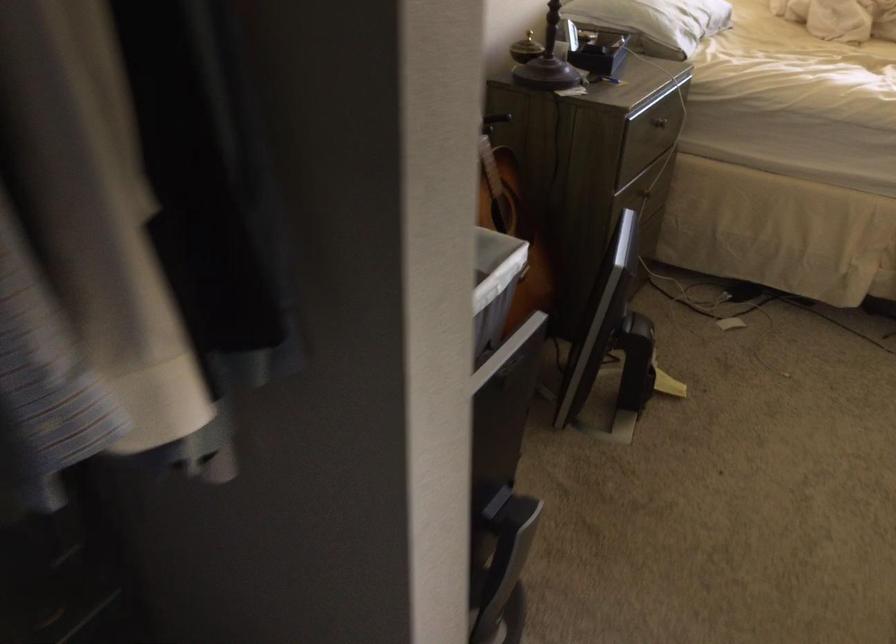
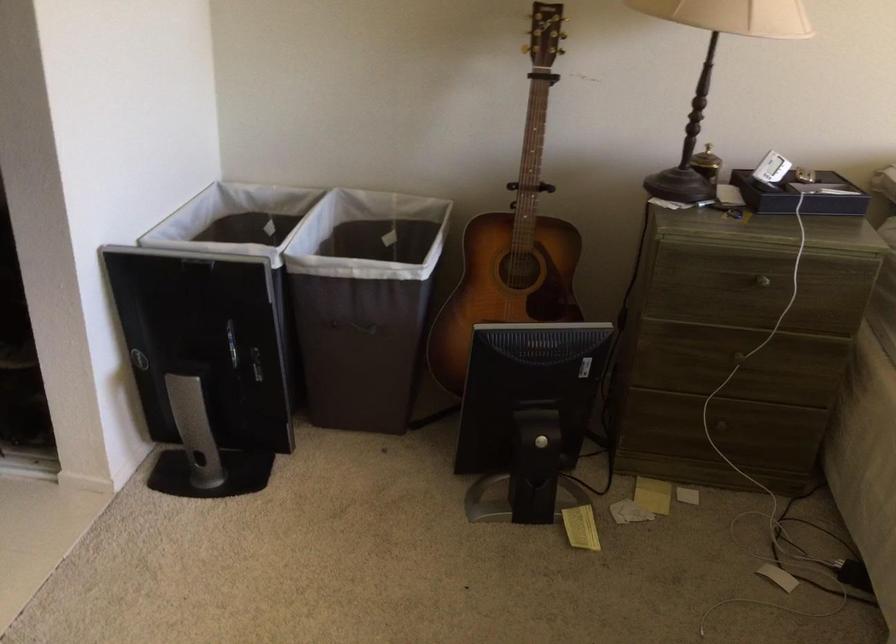
Where in the second image is the point corresponding to [665,124] from the first image?

(762, 281)